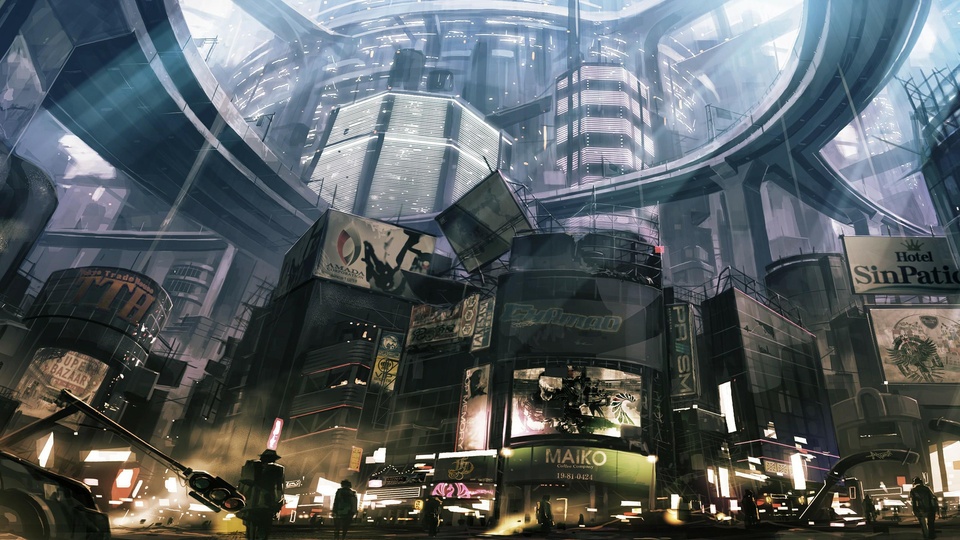
Locate an element on the screen. This screenshot has width=960, height=540. hotel is located at coordinates (914, 255).